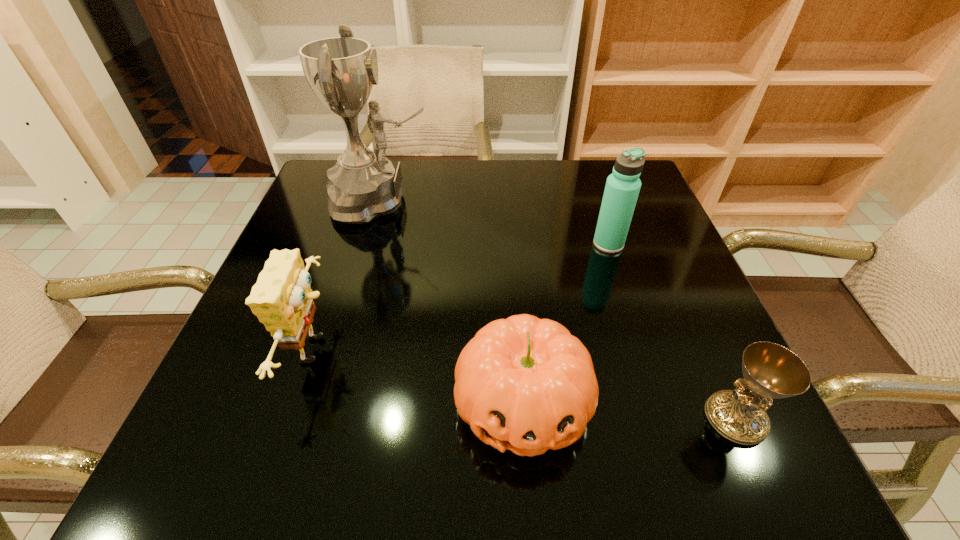
The width and height of the screenshot is (960, 540). I want to click on free location that satisfies the following two spatial constraints: 1. on the front side of the fourth object from left to right; 2. on the face of the sponge, so click(x=643, y=349).